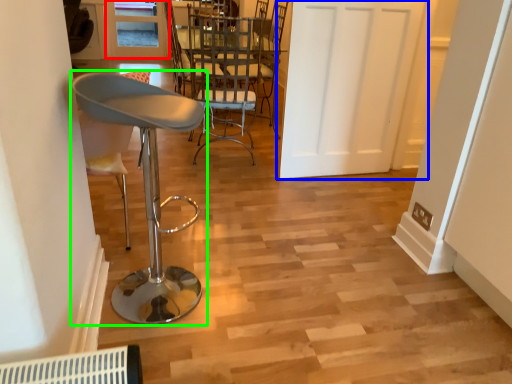
Question: Which is nearer to the window (highlighted by a red box)? door (highlighted by a blue box) or chair (highlighted by a green box).

Choices:
 (A) door
 (B) chair

Answer: (A)